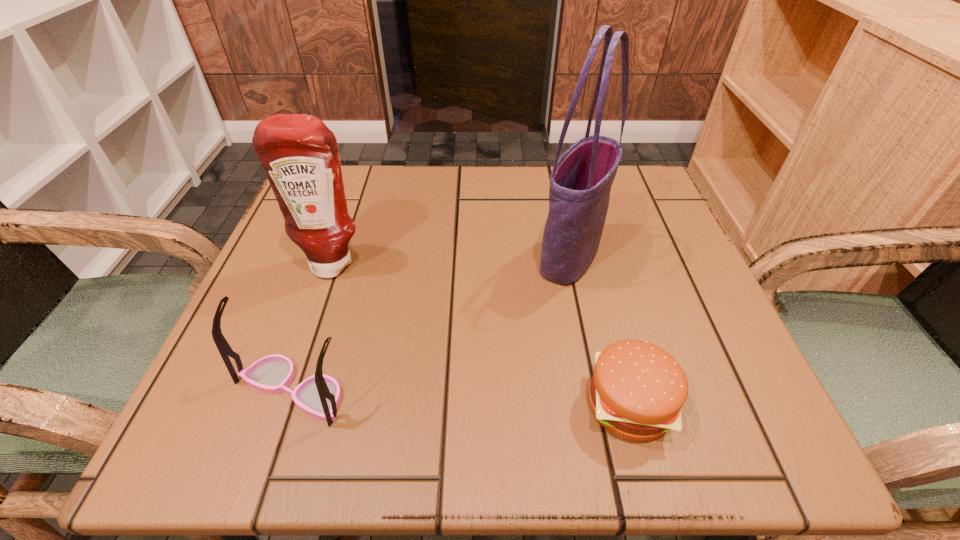
Identify the location of vacant point at the left edge. The width and height of the screenshot is (960, 540). (327, 314).

In the image, there is a desktop. Identify the location of vacant space at the right edge. (737, 374).

You are a GUI agent. You are given a task and a screenshot of the screen. Output one action in this format:
    pyautogui.click(x=<x>, y=<y>)
    Task: Click on the free space at the far left corner of the desktop
    The width and height of the screenshot is (960, 540).
    Given the screenshot: What is the action you would take?
    pyautogui.click(x=371, y=190)

Locate an element on the screen. Image resolution: width=960 pixels, height=540 pixels. vacant space at the near left corner of the desktop is located at coordinates (290, 450).

The height and width of the screenshot is (540, 960). What are the coordinates of `free space at the far right corner` in the screenshot? It's located at (639, 196).

I want to click on free spot at the near right corner of the desktop, so click(x=750, y=424).

At what (x,y) coordinates should I click in order to perform the action: click on free space between the second shortest object and the condiment. Please return your answer as a coordinate pair (x, y). The image size is (960, 540). Looking at the image, I should click on (313, 327).

This screenshot has height=540, width=960. In order to click on vacant space that is in between the tallest object and the spectacles in this screenshot , I will do `click(432, 323)`.

You are a GUI agent. You are given a task and a screenshot of the screen. Output one action in this format:
    pyautogui.click(x=<x>, y=<y>)
    Task: Click on the vacant space that is in between the tote bag and the hamburger
    This screenshot has width=960, height=540.
    Given the screenshot: What is the action you would take?
    pyautogui.click(x=599, y=330)

The width and height of the screenshot is (960, 540). Identify the location of vacant space in between the tote bag and the spectacles. (432, 323).